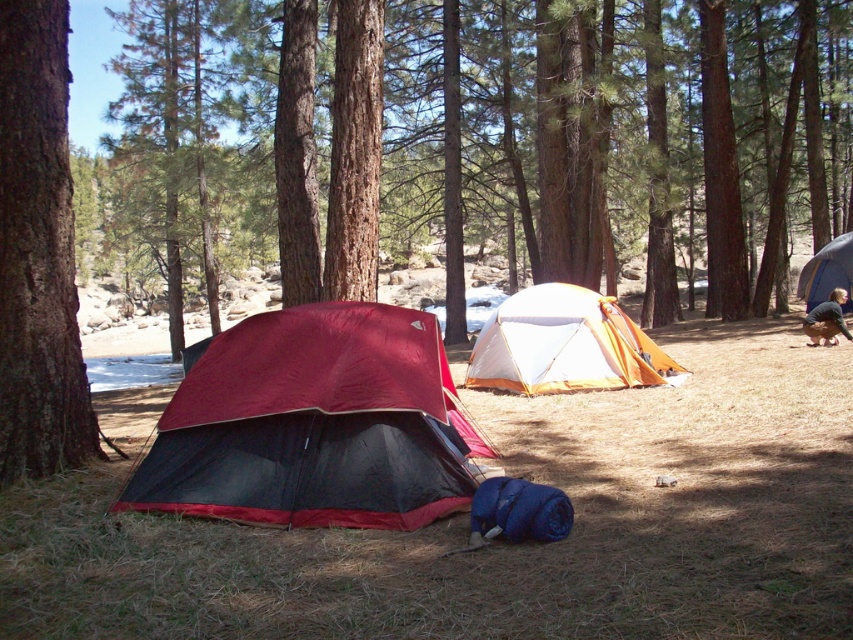
Between brown rough bark tree at left and white/orange fabric tent at center, which one has less height?

With less height is white/orange fabric tent at center.

Does brown rough bark tree at left appear on the right side of white/orange fabric tent at center?

Incorrect, brown rough bark tree at left is not on the right side of white/orange fabric tent at center.

You are a GUI agent. You are given a task and a screenshot of the screen. Output one action in this format:
    pyautogui.click(x=<x>, y=<y>)
    Task: Click on the brown rough bark tree at left
    
    Given the screenshot: What is the action you would take?
    pyautogui.click(x=38, y=252)

Where is `brown rough bark tree at left`? brown rough bark tree at left is located at coordinates (38, 252).

Does white/orange fabric tent at center have a lesser width compared to orange fabric tent at right?

Incorrect, white/orange fabric tent at center's width is not less than orange fabric tent at right's.

Is point (506, 378) closer to camera compared to point (809, 266)?

That is True.

Locate an element on the screen. The width and height of the screenshot is (853, 640). white/orange fabric tent at center is located at coordinates (564, 344).

Is maroon fabric tent at center to the left of white/orange fabric tent at center from the viewer's perspective?

Indeed, maroon fabric tent at center is positioned on the left side of white/orange fabric tent at center.

Which of these two, maroon fabric tent at center or white/orange fabric tent at center, stands shorter?

Standing shorter between the two is maroon fabric tent at center.

At what (x,y) coordinates should I click in order to perform the action: click on maroon fabric tent at center. Please return your answer as a coordinate pair (x, y). Image resolution: width=853 pixels, height=640 pixels. Looking at the image, I should click on (314, 424).

You are a GUI agent. You are given a task and a screenshot of the screen. Output one action in this format:
    pyautogui.click(x=<x>, y=<y>)
    Task: Click on the maroon fabric tent at center
    
    Given the screenshot: What is the action you would take?
    click(314, 424)